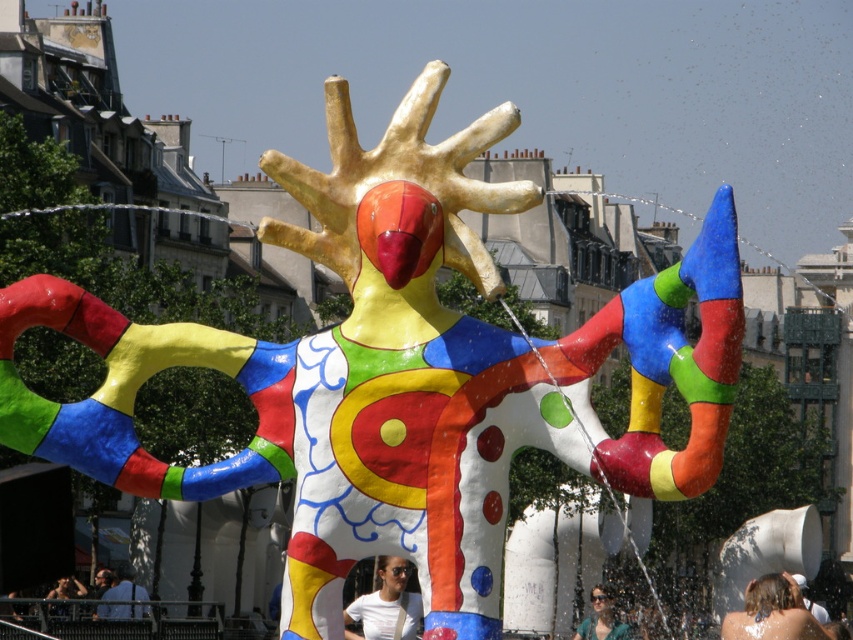
Question: Can you confirm if blonde hair at center is smaller than white matte t-shirt at lower center?

Choices:
 (A) yes
 (B) no

Answer: (B)

Question: Estimate the real-world distances between objects in this image. Which object is farther from the blonde hair at center?

Choices:
 (A) denim jacket at lower left
 (B) white matte t-shirt at lower center

Answer: (A)

Question: Which is nearer to the matte white sunglasses at lower center?

Choices:
 (A) white matte t-shirt at lower center
 (B) denim jacket at lower left
 (C) blonde hair at center

Answer: (C)

Question: Which of these objects is positioned closest to the matte white sunglasses at lower center?

Choices:
 (A) denim jacket at lower left
 (B) smooth skin person at lower left
 (C) white matte t-shirt at lower center
 (D) blonde hair at center

Answer: (D)

Question: Is white matte t-shirt at lower center to the left of matte white sunglasses at lower center from the viewer's perspective?

Choices:
 (A) no
 (B) yes

Answer: (B)

Question: Can you confirm if denim jacket at lower left is positioned above matte white sunglasses at lower center?

Choices:
 (A) no
 (B) yes

Answer: (B)